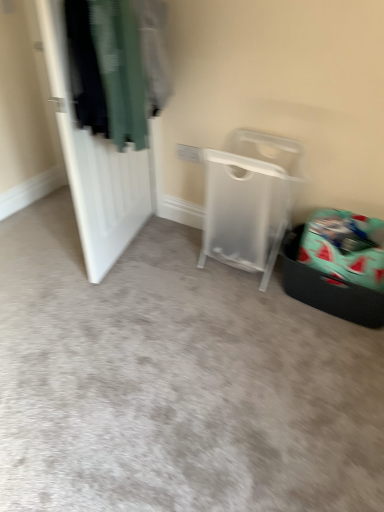
In order to face dark green fabric at left, should I rotate leftwards or rightwards?

To face it directly, rotate left by 8.688 degrees.

Where is `dark green fabric at left`? The width and height of the screenshot is (384, 512). dark green fabric at left is located at coordinates (117, 65).

Find the location of a particular element. This screenshot has width=384, height=512. white matte door at left is located at coordinates (96, 164).

Describe the element at coordinates (175, 382) in the screenshot. I see `transparent plastic trash bin at right` at that location.

Find the location of `teal fabric laundry basket at lower right`. teal fabric laundry basket at lower right is located at coordinates (337, 265).

Who is shorter, teal fabric laundry basket at lower right or transparent plastic laundry basket at center?

teal fabric laundry basket at lower right.

From the image's perspective, would you say teal fabric laundry basket at lower right is positioned over transparent plastic laundry basket at center?

No.

Can you confirm if teal fabric laundry basket at lower right is positioned to the left of transparent plastic laundry basket at center?

Incorrect, teal fabric laundry basket at lower right is not on the left side of transparent plastic laundry basket at center.

Is teal fabric laundry basket at lower right bigger or smaller than transparent plastic laundry basket at center?

Considering their sizes, teal fabric laundry basket at lower right takes up less space than transparent plastic laundry basket at center.

Is white matte door at left placed right next to transparent plastic trash bin at right?

white matte door at left and transparent plastic trash bin at right are clearly separated.

Considering the points (102, 262) and (164, 256), which point is behind, point (102, 262) or point (164, 256)?

Point (164, 256)

Which of these two, white matte door at left or transparent plastic trash bin at right, is bigger?

Bigger between the two is transparent plastic trash bin at right.

This screenshot has height=512, width=384. I want to click on plain that appears below the white matte door at left (from the image's perspective), so click(175, 382).

Is point (346, 273) positioned before point (310, 477)?

No.

Between teal fabric laundry basket at lower right and transparent plastic trash bin at right, which one appears on the right side from the viewer's perspective?

From the viewer's perspective, teal fabric laundry basket at lower right appears more on the right side.

Which is in front, teal fabric laundry basket at lower right or transparent plastic trash bin at right?

transparent plastic trash bin at right.

Are teal fabric laundry basket at lower right and transparent plastic trash bin at right making contact?

No, teal fabric laundry basket at lower right is not making contact with transparent plastic trash bin at right.

Is teal fabric laundry basket at lower right situated inside white matte door at left or outside?

teal fabric laundry basket at lower right is not inside white matte door at left, it's outside.

Would you say teal fabric laundry basket at lower right is a long distance from white matte door at left?

Yes, teal fabric laundry basket at lower right is far from white matte door at left.

Considering the positions of objects teal fabric laundry basket at lower right and white matte door at left in the image provided, who is in front, teal fabric laundry basket at lower right or white matte door at left?

white matte door at left is more forward.

Is teal fabric laundry basket at lower right taller than white matte door at left?

No, teal fabric laundry basket at lower right is not taller than white matte door at left.

Looking at this image, from the image's perspective, is transparent plastic trash bin at right under dark green fabric at left?

Correct, transparent plastic trash bin at right appears lower than dark green fabric at left in the image.

Does point (0, 447) lie in front of point (119, 13)?

That is True.

Which object is wider, transparent plastic trash bin at right or dark green fabric at left?

transparent plastic trash bin at right.

Looking at their sizes, would you say white matte door at left is wider or thinner than teal fabric laundry basket at lower right?

In the image, white matte door at left appears to be more narrow than teal fabric laundry basket at lower right.

Is white matte door at left looking in the opposite direction of teal fabric laundry basket at lower right?

Correct, white matte door at left is looking away from teal fabric laundry basket at lower right.

Considering the relative positions of white matte door at left and teal fabric laundry basket at lower right in the image provided, is white matte door at left to the left or to the right of teal fabric laundry basket at lower right?

white matte door at left is positioned on teal fabric laundry basket at lower right's left side.

From a real-world perspective, is white matte door at left under teal fabric laundry basket at lower right?

Incorrect, from a real-world perspective, white matte door at left is higher than teal fabric laundry basket at lower right.

Is transparent plastic laundry basket at center beside teal fabric laundry basket at lower right?

No, transparent plastic laundry basket at center is not touching teal fabric laundry basket at lower right.

Looking at this image, considering the positions of objects transparent plastic laundry basket at center and teal fabric laundry basket at lower right in the image provided, who is behind, transparent plastic laundry basket at center or teal fabric laundry basket at lower right?

teal fabric laundry basket at lower right is more distant.

How many degrees apart are the facing directions of transparent plastic laundry basket at center and teal fabric laundry basket at lower right?

The angle between the facing direction of transparent plastic laundry basket at center and the facing direction of teal fabric laundry basket at lower right is 0.261 degrees.

Is transparent plastic laundry basket at center wider than teal fabric laundry basket at lower right?

No.

Identify the location of laundry basket lying behind the transparent plastic laundry basket at center. This screenshot has width=384, height=512. (337, 265).

This screenshot has height=512, width=384. What are the coordinates of `plain located in front of the white matte door at left` in the screenshot? It's located at (175, 382).

Looking at the image, which one is located further to transparent plastic laundry basket at center, white matte door at left or transparent plastic trash bin at right?

Among the two, white matte door at left is located further to transparent plastic laundry basket at center.

When comparing their distances from white matte door at left, does teal fabric laundry basket at lower right or transparent plastic trash bin at right seem closer?

transparent plastic trash bin at right.

Which object lies nearer to the anchor point transparent plastic trash bin at right, transparent plastic laundry basket at center or dark green fabric at left?

transparent plastic laundry basket at center.

Considering their positions, is transparent plastic trash bin at right positioned closer to white matte door at left than dark green fabric at left?

dark green fabric at left.

Considering their positions, is transparent plastic trash bin at right positioned further to transparent plastic laundry basket at center than dark green fabric at left?

dark green fabric at left is further to transparent plastic laundry basket at center.

Which object lies further to the anchor point transparent plastic laundry basket at center, transparent plastic trash bin at right or teal fabric laundry basket at lower right?

Among the two, transparent plastic trash bin at right is located further to transparent plastic laundry basket at center.

Estimate the real-world distances between objects in this image. Which object is closer to transparent plastic laundry basket at center, transparent plastic trash bin at right or white matte door at left?

transparent plastic trash bin at right lies closer to transparent plastic laundry basket at center than the other object.

From the image, which object appears to be nearer to transparent plastic trash bin at right, white matte door at left or teal fabric laundry basket at lower right?

teal fabric laundry basket at lower right lies closer to transparent plastic trash bin at right than the other object.

The image size is (384, 512). In order to click on furniture between white matte door at left and transparent plastic trash bin at right in the up-down direction in this screenshot , I will do `click(249, 200)`.

You are a GUI agent. You are given a task and a screenshot of the screen. Output one action in this format:
    pyautogui.click(x=<x>, y=<y>)
    Task: Click on the furniture between dark green fabric at left and teal fabric laundry basket at lower right
    This screenshot has height=512, width=384.
    Given the screenshot: What is the action you would take?
    pyautogui.click(x=249, y=200)

The width and height of the screenshot is (384, 512). I want to click on clothing between white matte door at left and teal fabric laundry basket at lower right from left to right, so click(x=117, y=65).

Locate an element on the screen. This screenshot has height=512, width=384. furniture between transparent plastic trash bin at right and teal fabric laundry basket at lower right in the horizontal direction is located at coordinates tap(249, 200).